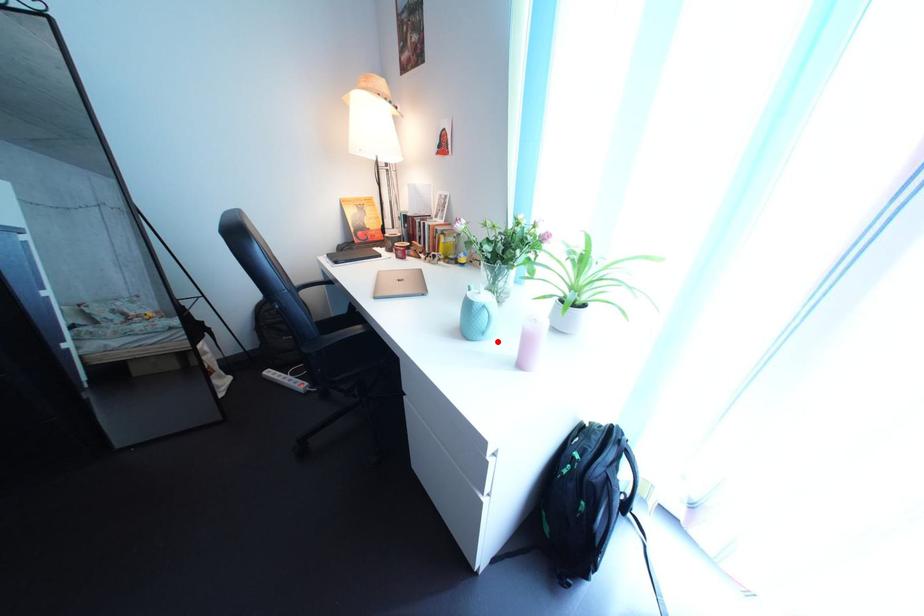
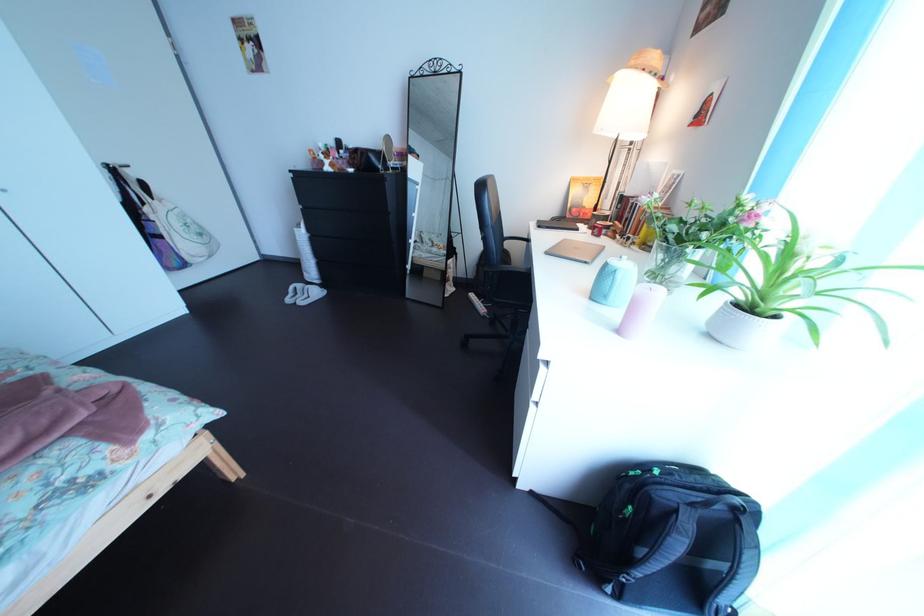
Find the pixel in the second image that matches the highlighted location in the first image.

(621, 305)